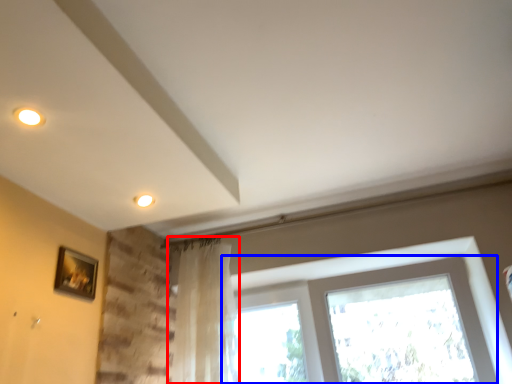
Question: Among these objects, which one is nearest to the camera, curtain (highlighted by a red box) or window (highlighted by a blue box)?

Choices:
 (A) curtain
 (B) window

Answer: (B)